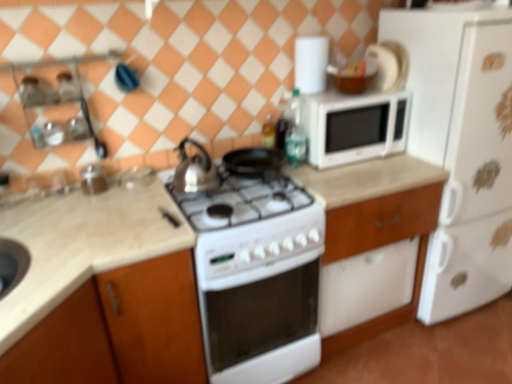
Question: Would you say silver metallic kettle at center is part of beige marble countertop at lower left, which is the 2th countertop from right to left,'s contents?

Choices:
 (A) yes
 (B) no

Answer: (B)

Question: Does beige marble countertop at lower left, positioned as the 1th countertop in left-to-right order, have a lesser width compared to silver metallic kettle at center?

Choices:
 (A) no
 (B) yes

Answer: (A)

Question: Considering the relative sizes of beige marble countertop at lower left, which is the 2th countertop from right to left, and silver metallic kettle at center in the image provided, is beige marble countertop at lower left, which is the 2th countertop from right to left, smaller than silver metallic kettle at center?

Choices:
 (A) no
 (B) yes

Answer: (A)

Question: Considering the relative sizes of beige marble countertop at lower left, positioned as the 1th countertop in left-to-right order, and silver metallic kettle at center in the image provided, is beige marble countertop at lower left, positioned as the 1th countertop in left-to-right order, shorter than silver metallic kettle at center?

Choices:
 (A) yes
 (B) no

Answer: (B)

Question: From the image's perspective, is beige marble countertop at lower left, which is the 2th countertop from right to left, beneath silver metallic kettle at center?

Choices:
 (A) yes
 (B) no

Answer: (A)

Question: Can we say beige marble countertop at lower left, which is the 2th countertop from right to left, lies outside silver metallic kettle at center?

Choices:
 (A) yes
 (B) no

Answer: (A)

Question: Is the depth of white glossy microwave at upper right, acting as the first appliance starting from the right, greater than that of silver metallic kettle at center?

Choices:
 (A) no
 (B) yes

Answer: (B)

Question: Is white glossy microwave at upper right, arranged as the second appliance when viewed from the front, far away from silver metallic kettle at center?

Choices:
 (A) no
 (B) yes

Answer: (A)

Question: Is white glossy microwave at upper right, arranged as the second appliance when viewed from the front, oriented away from silver metallic kettle at center?

Choices:
 (A) yes
 (B) no

Answer: (B)

Question: Does white glossy microwave at upper right, acting as the first appliance starting from the right, have a lesser width compared to silver metallic kettle at center?

Choices:
 (A) no
 (B) yes

Answer: (B)

Question: Can silver metallic kettle at center be found inside white glossy microwave at upper right, acting as the first appliance starting from the right?

Choices:
 (A) no
 (B) yes

Answer: (A)

Question: Considering the relative sizes of white glossy microwave at upper right, arranged as the second appliance when viewed from the front, and silver metallic kettle at center in the image provided, is white glossy microwave at upper right, arranged as the second appliance when viewed from the front, taller than silver metallic kettle at center?

Choices:
 (A) yes
 (B) no

Answer: (A)

Question: Does white matte refrigerator at right have a larger size compared to green glass bottle at upper right, marked as the second bottle in a left-to-right arrangement?

Choices:
 (A) no
 (B) yes

Answer: (B)